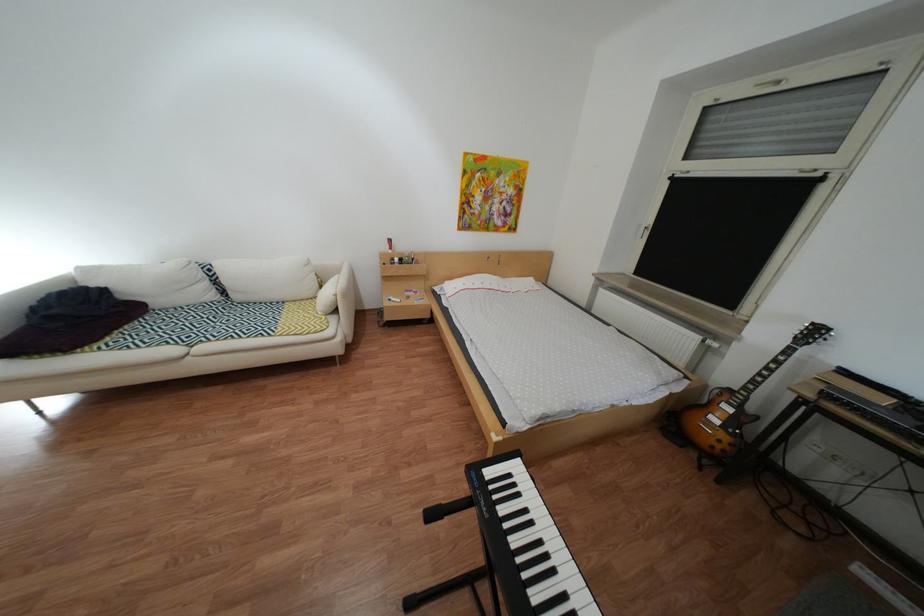
Where would you press the keyboard key? Please return your answer as a coordinate pair (x, y).

(561, 586)